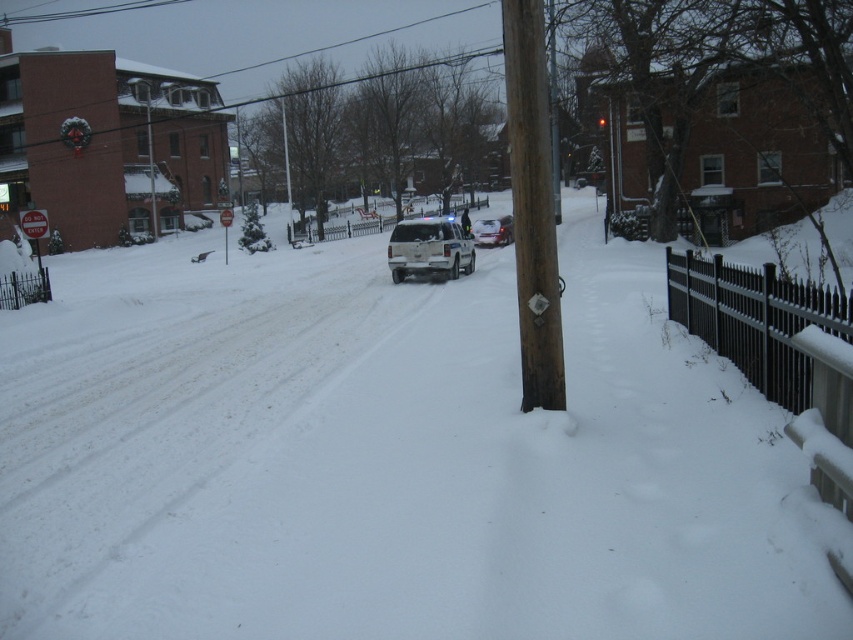
You are a driver approaching the intersection and see the satin silver suv at center and the red plastic stop sign at center. Which object is taller?

The satin silver suv at center is shorter than the red plastic stop sign at center, so the red plastic stop sign at center is taller.

You are standing at the edge of the snowy street and see the point marked at coordinates (386, 458). What is located at that point?

The point at coordinates (386, 458) indicates white fluffy snow at center.

You are a delivery drone flying over a snowy street. You need to land at a specific location. You see two points marked on your map as point 1 at coordinates point 1 at coordinates point [39,364] and point 2 at coordinates point [440,237]. Which point is closer to you if you are directly above the utility pole on the right side of the road?

Point 1 at coordinates point [39,364] is closer to you because it is in front of point 2 at coordinates point [440,237].